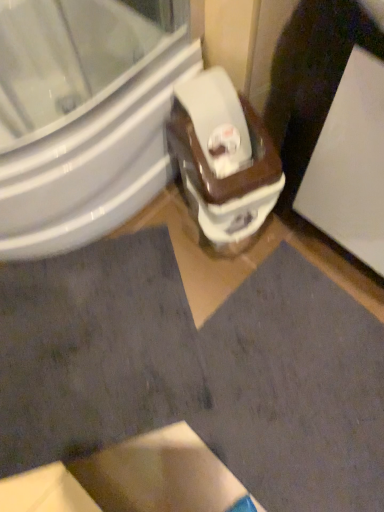
You are a GUI agent. You are given a task and a screenshot of the screen. Output one action in this format:
    pyautogui.click(x=<x>, y=<y>)
    Task: Click on the free space to the left of white glossy toilet at center
    
    Given the screenshot: What is the action you would take?
    pyautogui.click(x=162, y=224)